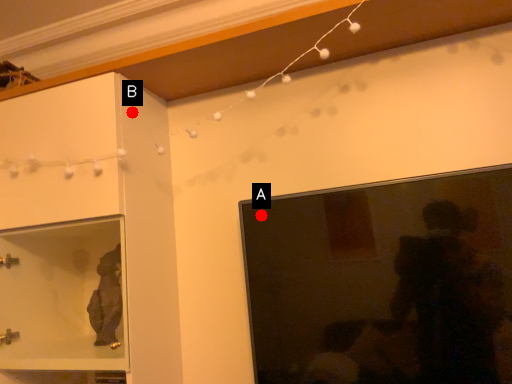
Question: Two points are circled on the image, labeled by A and B beside each circle. Which of the following is the farthest from the observer?

Choices:
 (A) A is further
 (B) B is further

Answer: (B)